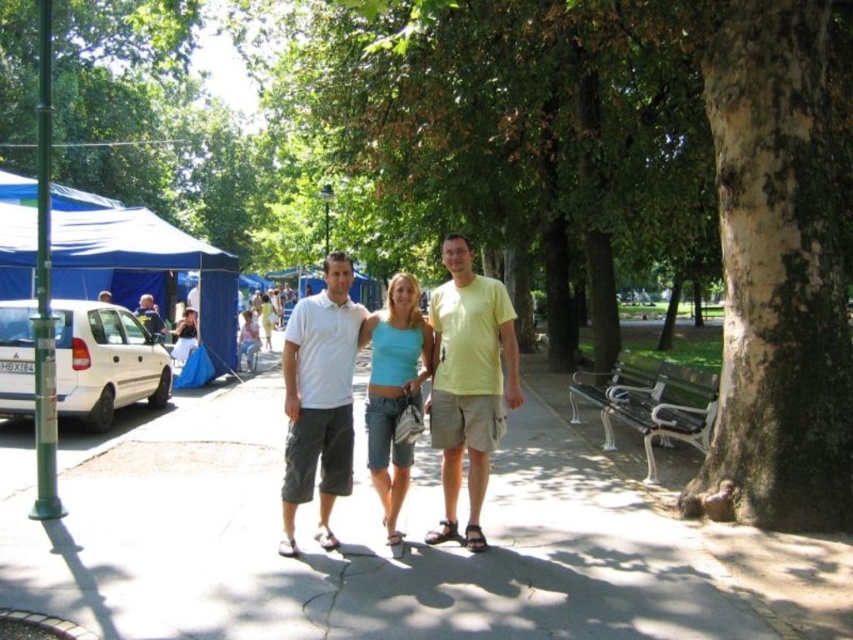
You are planning to set up a small picnic under the blue fabric canopy at left. You have a picnic blanket that is the same size as the light blue shirt at left. Will the blanket be large enough to cover the entire area under the canopy?

The blue fabric canopy at left is bigger than the light blue shirt at left. Since the picnic blanket is the same size as the light blue shirt at left, it will not be large enough to cover the entire area under the canopy.